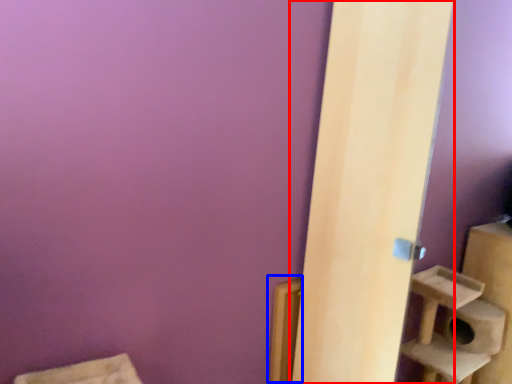
Question: Which of the following is the farthest to the observer, door (highlighted by a red box) or window sill (highlighted by a blue box)?

Choices:
 (A) door
 (B) window sill

Answer: (B)